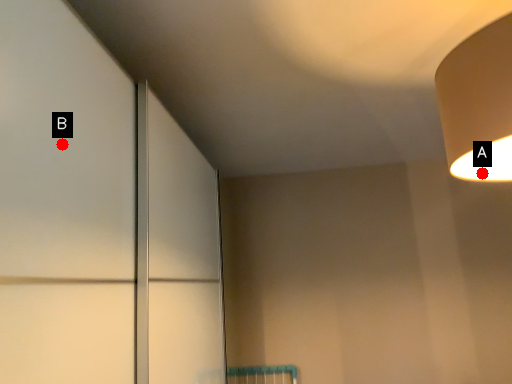
Question: Two points are circled on the image, labeled by A and B beside each circle. Which point appears closest to the camera in this image?

Choices:
 (A) A is closer
 (B) B is closer

Answer: (B)